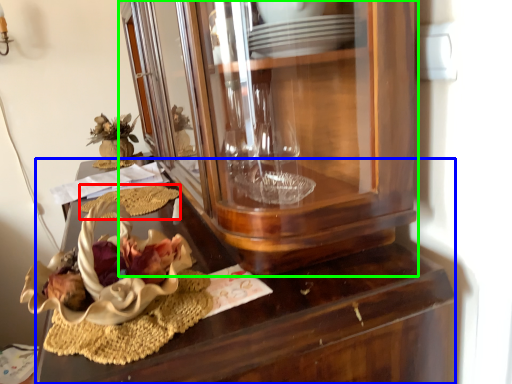
Question: Which object is positioned closest to food (highlighted by a red box)? Select from desk (highlighted by a blue box) and cabinetry (highlighted by a green box).

Choices:
 (A) desk
 (B) cabinetry

Answer: (A)